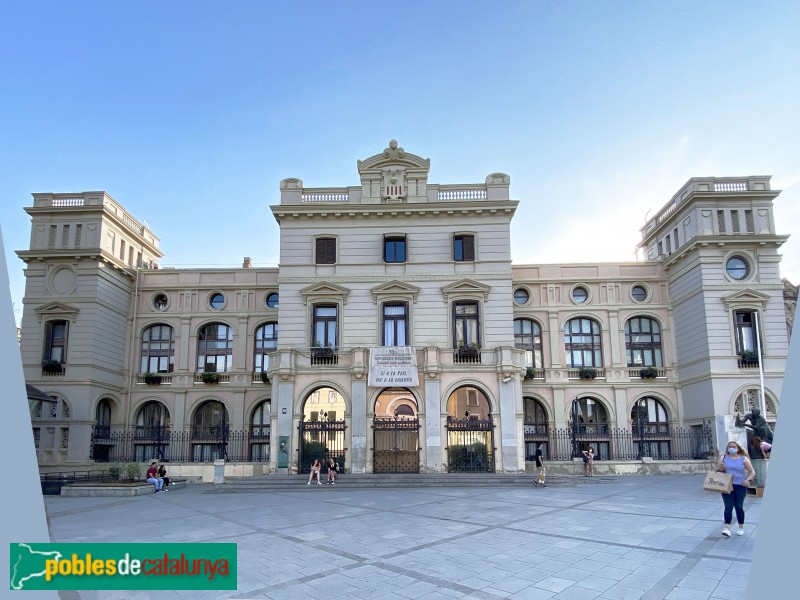
Where is `window`? window is located at coordinates (584, 364), (652, 351).